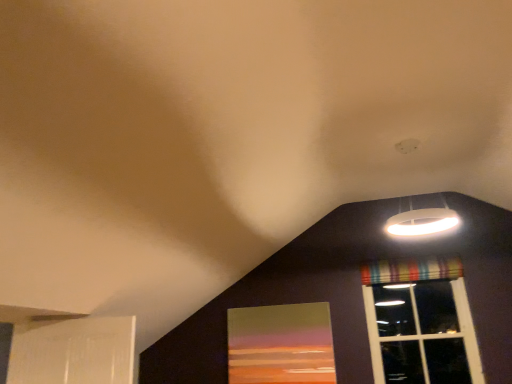
Measure the distance between point (x=439, y=261) and camera.

4.17 meters.

This screenshot has width=512, height=384. What do you see at coordinates (418, 309) in the screenshot?
I see `striped fabric window at upper right` at bounding box center [418, 309].

Locate an element on the screen. The width and height of the screenshot is (512, 384). matte glass window screen at lower center is located at coordinates (281, 344).

Could you tell me if matte glass window screen at lower center is facing striped fabric window at upper right?

No, matte glass window screen at lower center is not facing towards striped fabric window at upper right.

You are a GUI agent. You are given a task and a screenshot of the screen. Output one action in this format:
    pyautogui.click(x=<x>, y=<y>)
    Task: Click on the window positioned vertically above the matte glass window screen at lower center (from a real-world perspective)
    The image size is (512, 384).
    Given the screenshot: What is the action you would take?
    pyautogui.click(x=418, y=309)

Is matte glass window screen at lower center wider than striped fabric window at upper right?

In fact, matte glass window screen at lower center might be narrower than striped fabric window at upper right.

Looking at this image, is matte glass window screen at lower center positioned beyond the bounds of striped fabric window at upper right?

That's correct, matte glass window screen at lower center is outside of striped fabric window at upper right.

Where is `curtain above the matte glass window screen at lower center (from the image's perspective)`? The width and height of the screenshot is (512, 384). curtain above the matte glass window screen at lower center (from the image's perspective) is located at coordinates (411, 270).

Is striped fabric curtain at upper right facing towards matte glass window screen at lower center?

No, striped fabric curtain at upper right is not oriented towards matte glass window screen at lower center.

Which point is more distant from viewer, (423, 273) or (283, 373)?

Point (423, 273)

Who is smaller, striped fabric window at upper right or matte glass window screen at lower center?

matte glass window screen at lower center.

From a real-world perspective, is striped fabric window at upper right under matte glass window screen at lower center?

No, from a real-world perspective, striped fabric window at upper right is not below matte glass window screen at lower center.

In terms of width, does striped fabric window at upper right look wider or thinner when compared to matte glass window screen at lower center?

Considering their sizes, striped fabric window at upper right looks broader than matte glass window screen at lower center.

Considering the positions of point (467, 353) and point (310, 311), is point (467, 353) closer or farther from the camera than point (310, 311)?

Point (467, 353) appears to be closer to the viewer than point (310, 311).

From the image's perspective, between white matte lampshade at upper right and striped fabric window at upper right, which one is located above?

From the image's view, white matte lampshade at upper right is above.

Locate an element on the screen. The image size is (512, 384). lamp located in front of the striped fabric window at upper right is located at coordinates (422, 217).

Which point is more forward, (x=425, y=224) or (x=405, y=278)?

Positioned in front is point (x=425, y=224).

Which object is thinner, white matte lampshade at upper right or striped fabric window at upper right?

Thinner between the two is striped fabric window at upper right.

Considering the positions of points (275, 363) and (447, 267), is point (275, 363) closer to camera compared to point (447, 267)?

Yes, it is.

Is matte glass window screen at lower center located outside striped fabric curtain at upper right?

Absolutely, matte glass window screen at lower center is external to striped fabric curtain at upper right.

Which object is positioned more to the right, matte glass window screen at lower center or striped fabric curtain at upper right?

striped fabric curtain at upper right is more to the right.

From the image's perspective, between matte glass window screen at lower center and striped fabric curtain at upper right, who is located below?

matte glass window screen at lower center is shown below in the image.

In terms of height, does white matte lampshade at upper right look taller or shorter compared to striped fabric curtain at upper right?

In the image, white matte lampshade at upper right appears to be taller than striped fabric curtain at upper right.

Is white matte lampshade at upper right in contact with striped fabric curtain at upper right?

No.

Is white matte lampshade at upper right at the right side of striped fabric curtain at upper right?

In fact, white matte lampshade at upper right is to the left of striped fabric curtain at upper right.

Does white matte lampshade at upper right have a smaller size compared to striped fabric curtain at upper right?

Actually, white matte lampshade at upper right might be larger than striped fabric curtain at upper right.

Which of these two, striped fabric window at upper right or white matte lampshade at upper right, stands shorter?

With less height is white matte lampshade at upper right.

Which object is further away from the camera taking this photo, striped fabric window at upper right or white matte lampshade at upper right?

striped fabric window at upper right is further away from the camera.

Does striped fabric window at upper right have a lesser width compared to white matte lampshade at upper right?

Yes, striped fabric window at upper right is thinner than white matte lampshade at upper right.

I want to click on window screen behind the striped fabric window at upper right, so click(x=281, y=344).

Identify the location of window screen below the striped fabric curtain at upper right (from the image's perspective). (281, 344).

When comparing their distances from striped fabric window at upper right, does matte glass window screen at lower center or white matte lampshade at upper right seem further?

Among the two, matte glass window screen at lower center is located further to striped fabric window at upper right.

When comparing their distances from striped fabric window at upper right, does white matte lampshade at upper right or striped fabric curtain at upper right seem further?

white matte lampshade at upper right.

When comparing their distances from white matte lampshade at upper right, does striped fabric window at upper right or matte glass window screen at lower center seem closer?

striped fabric window at upper right lies closer to white matte lampshade at upper right than the other object.

Looking at the image, which one is located closer to white matte lampshade at upper right, striped fabric curtain at upper right or striped fabric window at upper right?

striped fabric curtain at upper right.

Estimate the real-world distances between objects in this image. Which object is further from white matte lampshade at upper right, striped fabric window at upper right or striped fabric curtain at upper right?

striped fabric window at upper right is positioned further to the anchor white matte lampshade at upper right.

Looking at the image, which one is located further to white matte lampshade at upper right, matte glass window screen at lower center or striped fabric curtain at upper right?

matte glass window screen at lower center lies further to white matte lampshade at upper right than the other object.

Looking at the image, which one is located further to matte glass window screen at lower center, white matte lampshade at upper right or striped fabric window at upper right?

white matte lampshade at upper right.

When comparing their distances from striped fabric curtain at upper right, does matte glass window screen at lower center or white matte lampshade at upper right seem closer?

The object closer to striped fabric curtain at upper right is white matte lampshade at upper right.

Locate an element on the screen. This screenshot has width=512, height=384. window between white matte lampshade at upper right and striped fabric curtain at upper right in the front-back direction is located at coordinates (418, 309).

Locate an element on the screen. The image size is (512, 384). curtain between white matte lampshade at upper right and matte glass window screen at lower center vertically is located at coordinates (411, 270).

Where is `curtain between matte glass window screen at lower center and striped fabric window at upper right in the horizontal direction`? This screenshot has width=512, height=384. curtain between matte glass window screen at lower center and striped fabric window at upper right in the horizontal direction is located at coordinates (411, 270).

I want to click on window between white matte lampshade at upper right and matte glass window screen at lower center in the up-down direction, so click(418, 309).